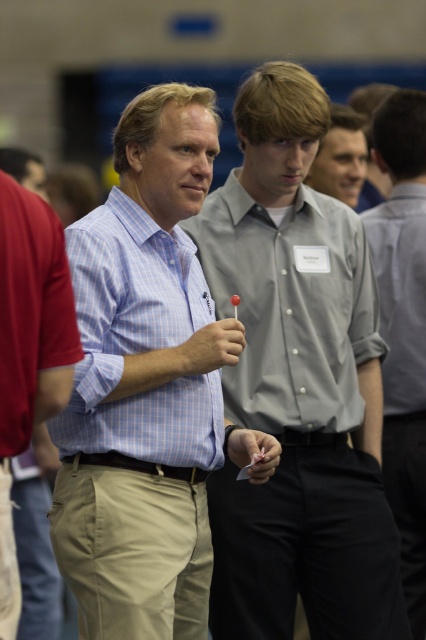
You are standing in the center of the room and want to approach the khaki pants at center. Which direction should you move to reach them?

The khaki pants at center are located at point coordinates, so you should move towards the center of the room to reach them.

You are organizing a photo shoot in this room and need to place two cameras to capture both the light blue checkered shirt at center and the other man clearly. The minimum distance between the cameras should be 5 meters to avoid overlapping footage. Do you think the current spacing between the two men allows for this setup?

The two men are 4.51 meters apart, which is less than the required 5 meters. Therefore, the current spacing does not allow for placing the cameras 5 meters apart without overlapping footage.